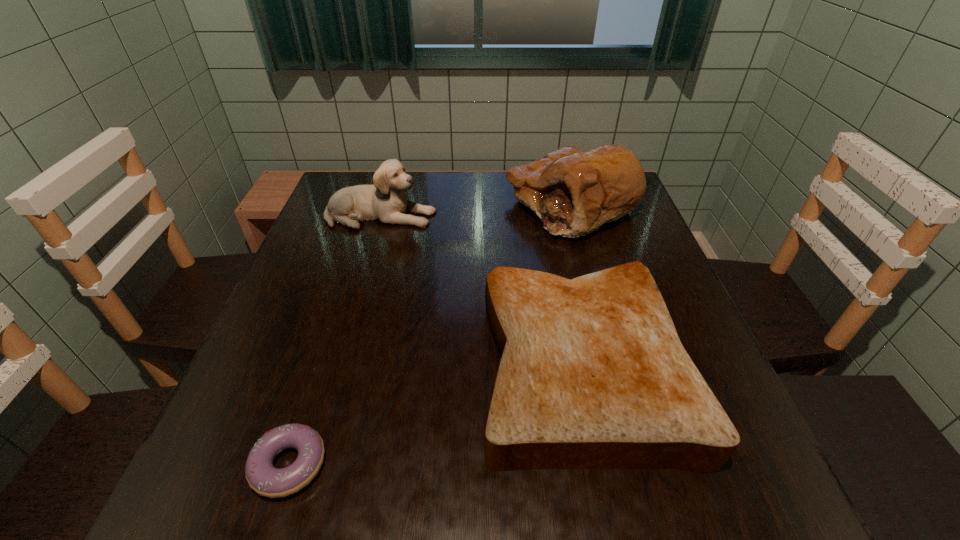
Where is `empty space that is in between the second shortest object and the puppy`? This screenshot has height=540, width=960. empty space that is in between the second shortest object and the puppy is located at coordinates (481, 289).

You are a GUI agent. You are given a task and a screenshot of the screen. Output one action in this format:
    pyautogui.click(x=<x>, y=<y>)
    Task: Click on the free spot between the shortest object and the shorter bread
    The image size is (960, 540).
    Given the screenshot: What is the action you would take?
    pyautogui.click(x=436, y=414)

Identify which object is the third closest to the shortest object. Please provide its 2D coordinates. Your answer should be formatted as a tuple, i.e. [(x, y)], where the tuple contains the x and y coordinates of a point satisfying the conditions above.

[(573, 192)]

You are a GUI agent. You are given a task and a screenshot of the screen. Output one action in this format:
    pyautogui.click(x=<x>, y=<y>)
    Task: Click on the second closest object to the shorter bread
    This screenshot has height=540, width=960.
    Given the screenshot: What is the action you would take?
    pyautogui.click(x=385, y=201)

Locate an element on the screen. blank space that satisfies the following two spatial constraints: 1. on the filling side of the taller bread; 2. on the front side of the second shortest object is located at coordinates (615, 363).

Identify the location of free space that satisfies the following two spatial constraints: 1. on the front-facing side of the nearer bread; 2. on the left side of the third shortest object. Image resolution: width=960 pixels, height=540 pixels. 337,363.

You are a GUI agent. You are given a task and a screenshot of the screen. Output one action in this format:
    pyautogui.click(x=<x>, y=<y>)
    Task: Click on the free space that satisfies the following two spatial constraints: 1. on the front-facing side of the third shortest object; 2. on the left side of the shorter bread
    This screenshot has height=540, width=960.
    Given the screenshot: What is the action you would take?
    pyautogui.click(x=337, y=363)